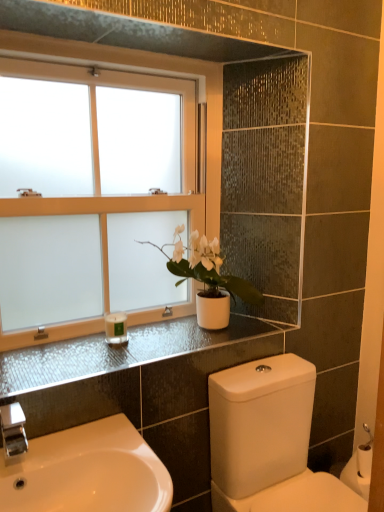
Image resolution: width=384 pixels, height=512 pixels. What are the coordinates of `vacant space in front of white matte candle at lower left` in the screenshot? It's located at (107, 369).